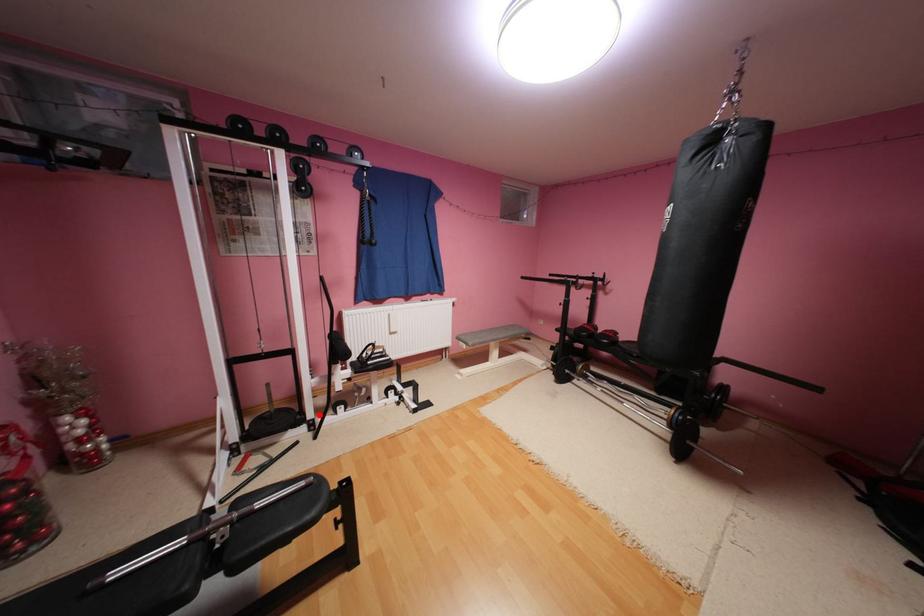
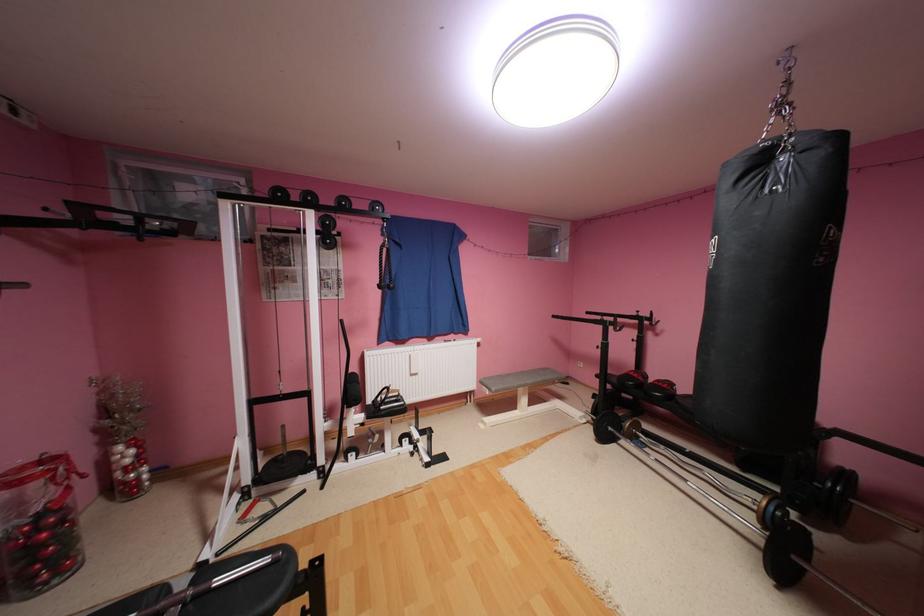
Question: I am providing you with two images of the same scene from different viewpoints. In image1, a red point is highlighted. Considering the same 3D point in image2, which of the following is correct?

Choices:
 (A) It is closer
 (B) It is farther

Answer: (A)